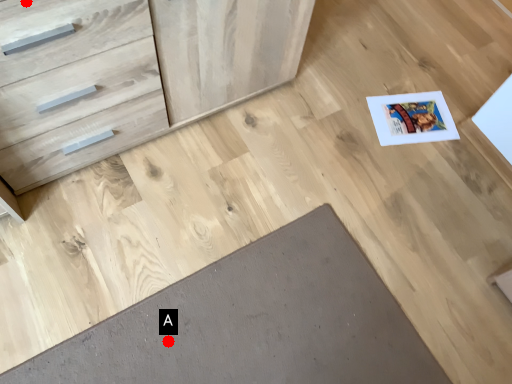
Question: Two points are circled on the image, labeled by A and B beside each circle. Which point is closer to the camera?

Choices:
 (A) A is closer
 (B) B is closer

Answer: (B)